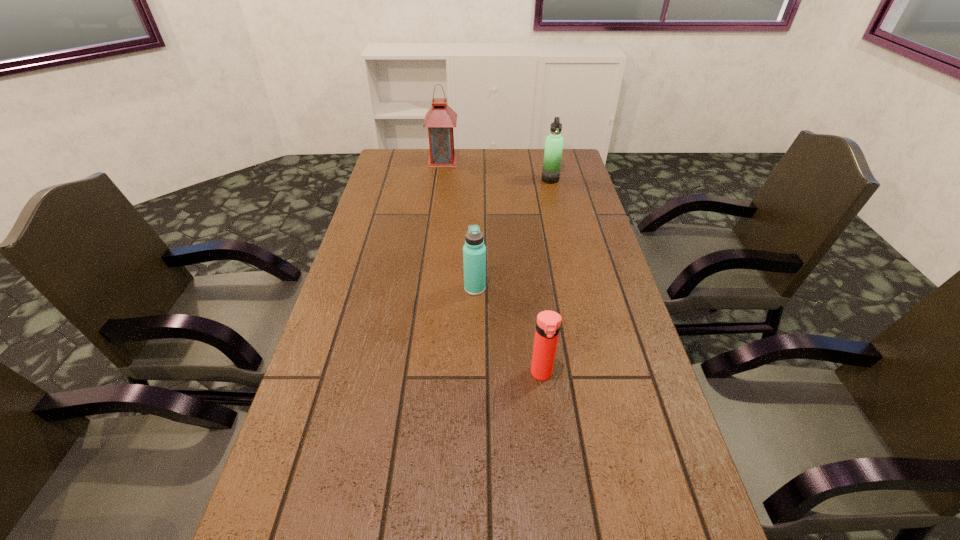
The image size is (960, 540). Find the location of `free space located 0.220m on the front of the second nearest object`. free space located 0.220m on the front of the second nearest object is located at coordinates (474, 363).

Locate an element on the screen. This screenshot has height=540, width=960. free space located 0.340m on the back of the second thermos bottle from right to left is located at coordinates (528, 266).

Where is `lantern at the far edge`? lantern at the far edge is located at coordinates (440, 119).

This screenshot has height=540, width=960. Find the location of `thermos bottle that is at the far edge`. thermos bottle that is at the far edge is located at coordinates (554, 142).

Find the location of a particular element. This screenshot has width=960, height=540. object present at the right edge is located at coordinates (554, 142).

Find the location of a particular element. The width and height of the screenshot is (960, 540). object situated at the far right corner is located at coordinates (554, 142).

Locate an element on the screen. free region at the far edge of the desktop is located at coordinates (462, 160).

Where is `vacant space at the left edge`? The image size is (960, 540). vacant space at the left edge is located at coordinates (372, 423).

Find the location of a particular element. vacant region at the right edge of the desktop is located at coordinates (553, 247).

Identify the location of vacant space at the far left corner. (379, 175).